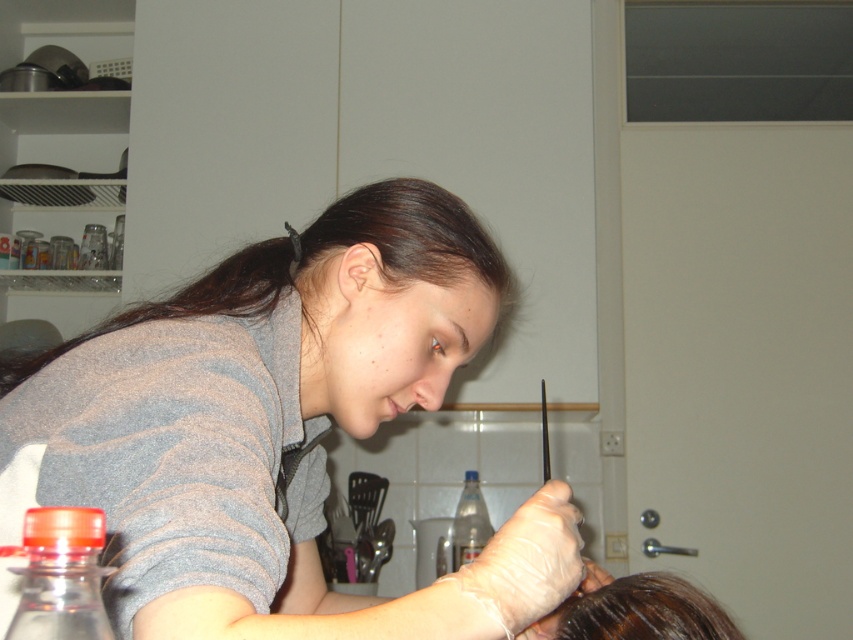
Is point (44, 588) positioned after point (469, 556)?

No, it is in front of (469, 556).

The image size is (853, 640). What do you see at coordinates (61, 576) in the screenshot? I see `transparent plastic bottle at lower left` at bounding box center [61, 576].

This screenshot has width=853, height=640. What do you see at coordinates (61, 576) in the screenshot?
I see `transparent plastic bottle at lower left` at bounding box center [61, 576].

You are a GUI agent. You are given a task and a screenshot of the screen. Output one action in this format:
    pyautogui.click(x=<x>, y=<y>)
    Task: Click on the transparent plastic bottle at lower left
    
    Given the screenshot: What is the action you would take?
    pyautogui.click(x=61, y=576)

Is gray matte shirt at upper left smaller than translucent plastic bottle at center?

Actually, gray matte shirt at upper left might be larger than translucent plastic bottle at center.

Who is taller, gray matte shirt at upper left or translucent plastic bottle at center?

gray matte shirt at upper left

Locate an element on the screen. The height and width of the screenshot is (640, 853). gray matte shirt at upper left is located at coordinates (277, 428).

Consider the image. Does gray matte shirt at upper left appear on the left side of transparent plastic bottle at lower left?

No, gray matte shirt at upper left is not to the left of transparent plastic bottle at lower left.

Measure the distance between point (384,344) and camera.

82.58 centimeters

Between point (131, 621) and point (77, 589), which one is positioned behind?

Point (131, 621)

Locate an element on the screen. The height and width of the screenshot is (640, 853). gray matte shirt at upper left is located at coordinates (277, 428).